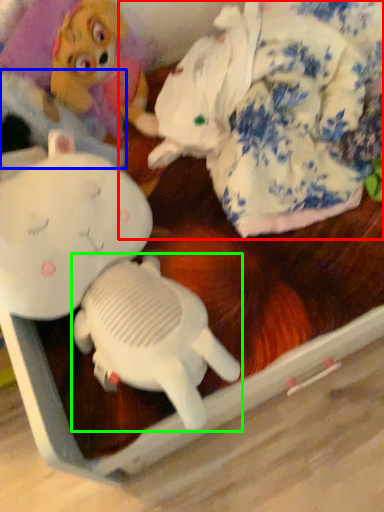
Question: Estimate the real-world distances between objects in this image. Which object is closer to toy (highlighted by a red box), clothing (highlighted by a blue box) or toy (highlighted by a green box)?

Choices:
 (A) clothing
 (B) toy

Answer: (A)